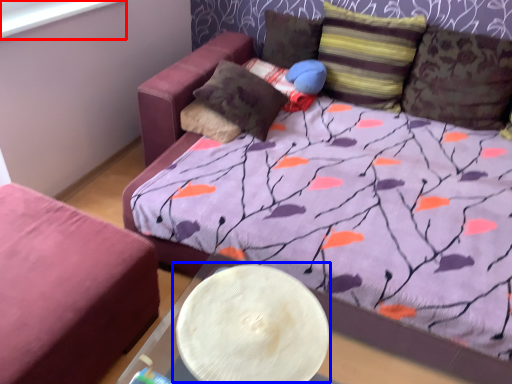
Question: Which object is closer to the camera taking this photo, window screen (highlighted by a red box) or round table (highlighted by a blue box)?

Choices:
 (A) window screen
 (B) round table

Answer: (B)